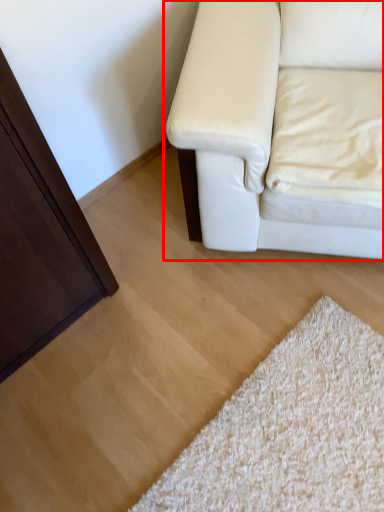
Question: From the image's perspective, what is the correct spatial positioning of studio couch (annotated by the red box) in reference to pillow?

Choices:
 (A) below
 (B) above

Answer: (B)